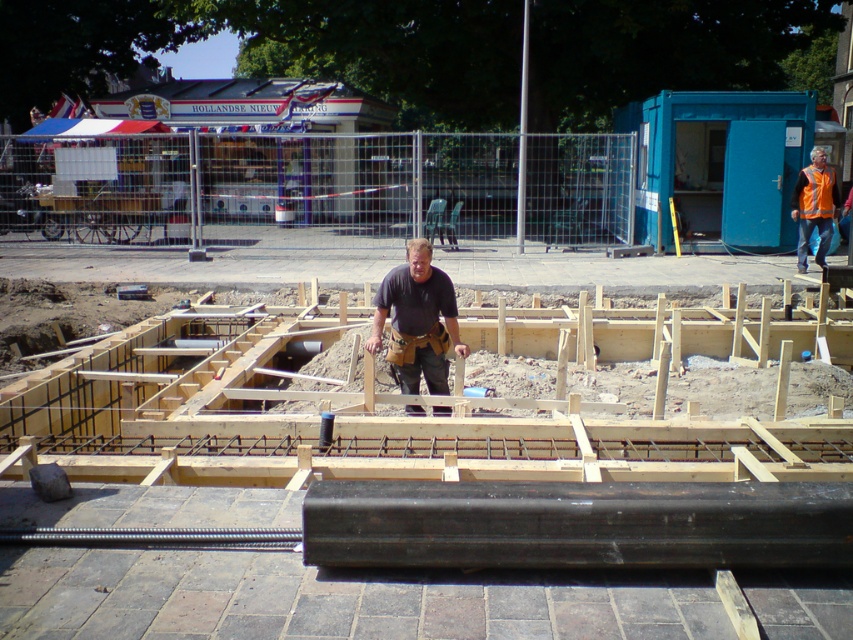
Question: Can you confirm if brown leather tool belt at center is positioned to the left of orange reflective vest at right?

Choices:
 (A) no
 (B) yes

Answer: (B)

Question: Which point is closer to the camera taking this photo?

Choices:
 (A) (833, 184)
 (B) (402, 291)

Answer: (B)

Question: Can you confirm if brown leather tool belt at center is positioned to the left of orange reflective vest at right?

Choices:
 (A) no
 (B) yes

Answer: (B)

Question: Which point is closer to the camera?

Choices:
 (A) (386, 289)
 (B) (808, 186)

Answer: (A)

Question: Is brown leather tool belt at center positioned in front of orange reflective vest at right?

Choices:
 (A) yes
 (B) no

Answer: (A)